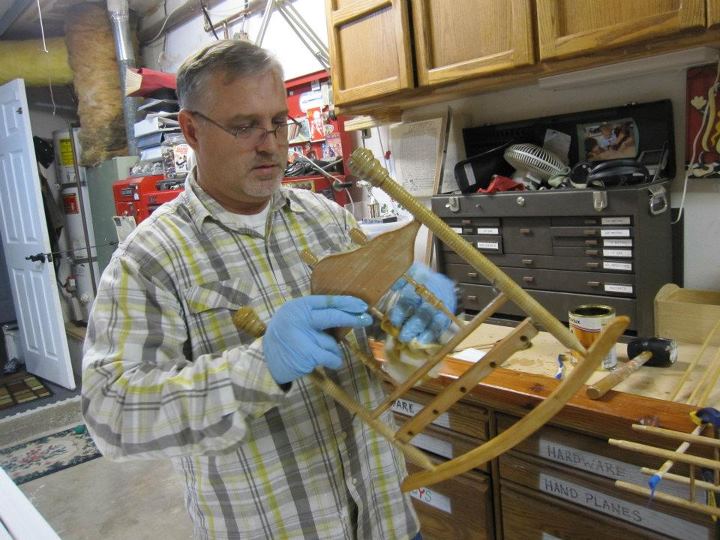
Find the location of a particular element. floor is located at coordinates (x=124, y=518).